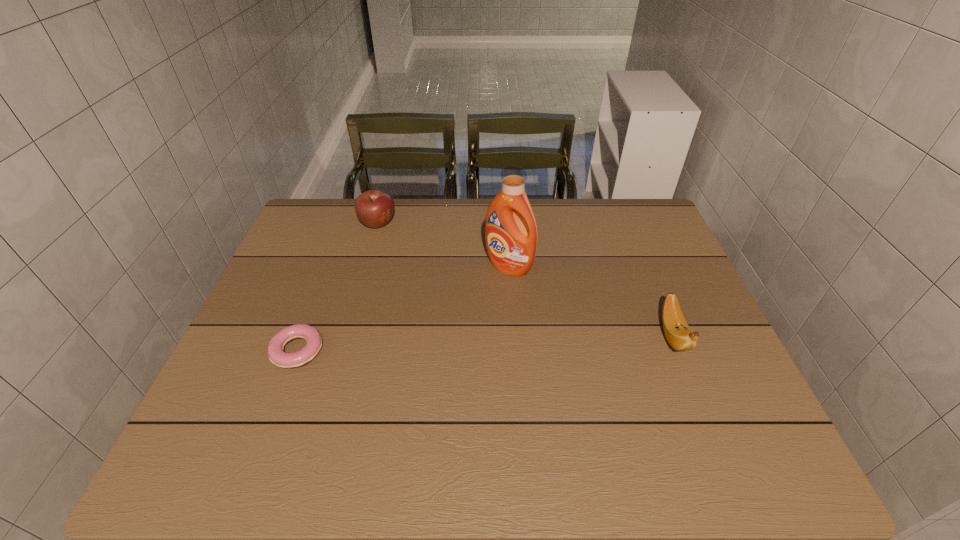
The width and height of the screenshot is (960, 540). What are the coordinates of `vacant space on the desktop that is between the doughnut and the rightmost object and is positioned on the side of the farthest object with the unique marking` in the screenshot? It's located at (447, 345).

Where is `vacant space on the desktop that is between the doughnut and the banana and is positioned on the front-facing side of the detergent`? vacant space on the desktop that is between the doughnut and the banana and is positioned on the front-facing side of the detergent is located at coordinates (432, 345).